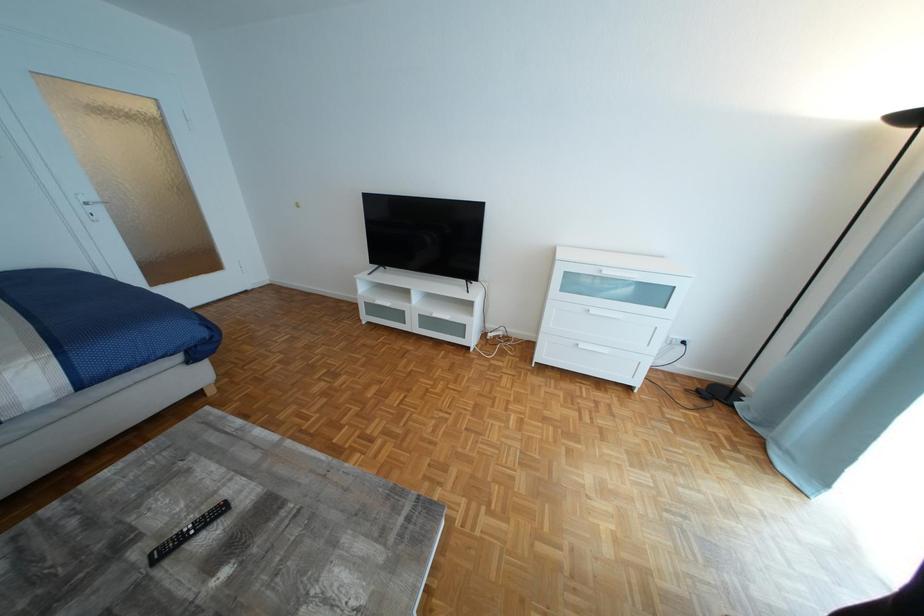
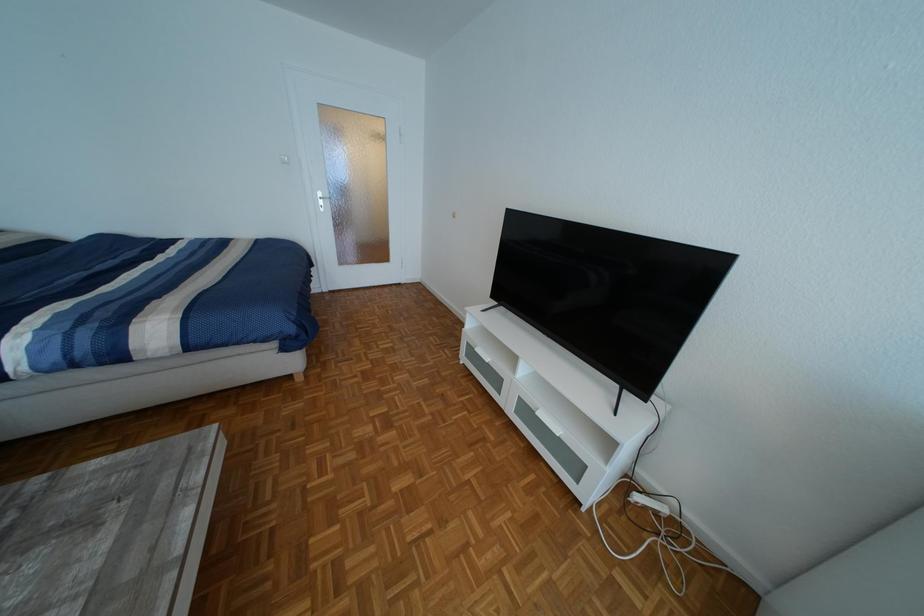
Question: The images are taken continuously from a first-person perspective. In which direction is your viewpoint rotating?

Choices:
 (A) Left
 (B) Right
 (C) Up
 (D) Down

Answer: (A)